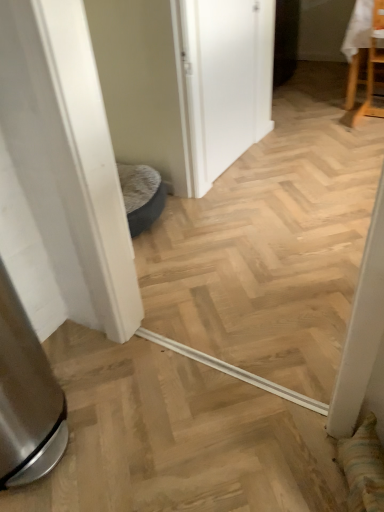
The image size is (384, 512). I want to click on unoccupied region to the right of white matte door at center, so click(294, 160).